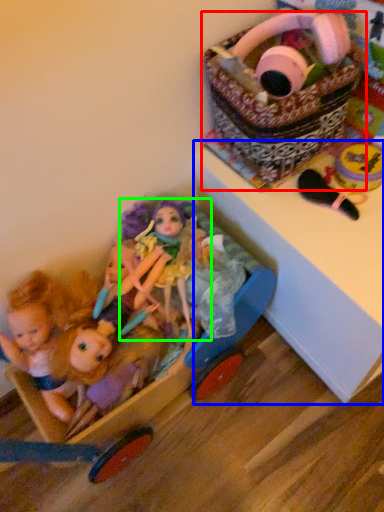
Question: Which is farther away from basket (highlighted by a red box)? changing table (highlighted by a blue box) or doll (highlighted by a green box)?

Choices:
 (A) changing table
 (B) doll

Answer: (B)